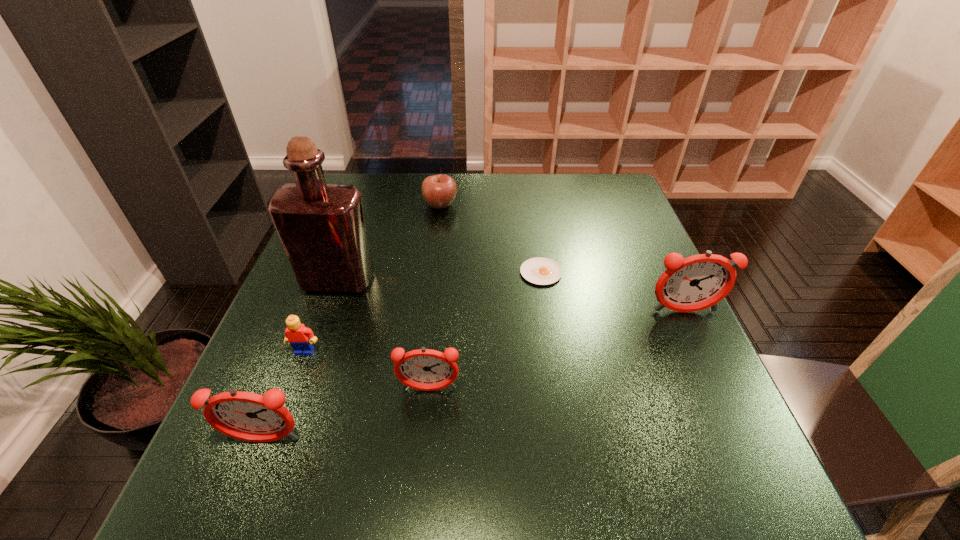
To achieve even spacing by inserting another alarm_clock among them, please point to a vacant spot for this new alarm_clock. Please provide its 2D coordinates. Your answer should be formatted as a tuple, i.e. [(x, y)], where the tuple contains the x and y coordinates of a point satisfying the conditions above.

[(567, 348)]